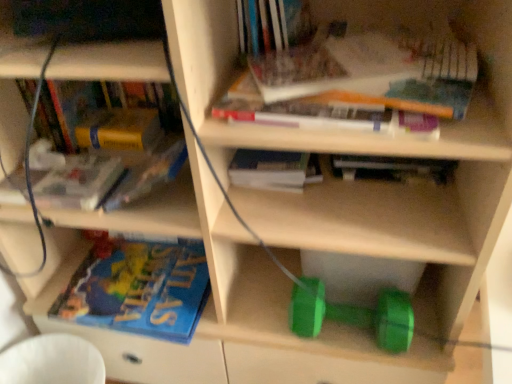
In order to click on yellow matte book at upper left, which is the third book in bottom-to-top order in this screenshot , I will do `click(148, 173)`.

Identify the location of white plastic swivel chair at lower left. (52, 361).

Measure the distance between point (118, 141) and camera.

A distance of 36.69 inches exists between point (118, 141) and camera.

Describe the element at coordinates (120, 130) in the screenshot. I see `yellow matte paperback book at upper left` at that location.

Describe the element at coordinates (274, 170) in the screenshot. The width and height of the screenshot is (512, 384). I see `hardcover book at center, which ranks as the third book in top-to-bottom order` at that location.

Describe the element at coordinates (353, 314) in the screenshot. I see `green rubber dumbbell at lower center` at that location.

Where is `green rubber dumbbell at lower center`? green rubber dumbbell at lower center is located at coordinates (353, 314).

What is the approximate height of hardcover book at upper center, the fourth book viewed from the top?

The height of hardcover book at upper center, the fourth book viewed from the top, is 2.62 inches.

You are a GUI agent. You are given a task and a screenshot of the screen. Output one action in this format:
    pyautogui.click(x=<x>, y=<y>)
    Task: Click on the hardcover book at upper center, the 2th book viewed from the top
    The height and width of the screenshot is (384, 512).
    Given the screenshot: What is the action you would take?
    pyautogui.click(x=357, y=80)

Which of these two, hardcover book at upper center, the 4th book positioned from the bottom, or green rubber dumbbell at lower center, stands taller?

green rubber dumbbell at lower center.

From the image's perspective, which object appears higher, hardcover book at upper center, the fourth book viewed from the top, or green rubber dumbbell at lower center?

hardcover book at upper center, the fourth book viewed from the top, from the image's perspective.

Which object is wider, hardcover book at upper center, the 4th book positioned from the bottom, or green rubber dumbbell at lower center?

green rubber dumbbell at lower center is wider.

Measure the distance from hardcover book at upper center, the 4th book positioned from the bottom, to green rubber dumbbell at lower center.

A distance of 25.49 centimeters exists between hardcover book at upper center, the 4th book positioned from the bottom, and green rubber dumbbell at lower center.

Which point is more distant from viewer, (104, 201) or (426, 167)?

Point (426, 167)

How far apart are yellow matte book at upper left, which is the third book in bottom-to-top order, and hardcover book at upper center, the 4th book positioned from the bottom?

yellow matte book at upper left, which is the third book in bottom-to-top order, and hardcover book at upper center, the 4th book positioned from the bottom, are 38.49 centimeters apart.

Consider the image. From the image's perspective, which object appears higher, yellow matte book at upper left, acting as the fifth book starting from the top, or hardcover book at upper center, the 4th book positioned from the bottom?

hardcover book at upper center, the 4th book positioned from the bottom, from the image's perspective.

From the image's perspective, is green rubber dumbbell at lower center beneath hardcover book at center, which is counted as the 5th book, starting from the bottom?

Yes, from the image's perspective, green rubber dumbbell at lower center is below hardcover book at center, which is counted as the 5th book, starting from the bottom.

How distant is green rubber dumbbell at lower center from hardcover book at center, which ranks as the third book in top-to-bottom order?

They are 9.96 inches apart.

Are green rubber dumbbell at lower center and hardcover book at center, which ranks as the third book in top-to-bottom order, far apart?

No, there isn't a large distance between green rubber dumbbell at lower center and hardcover book at center, which ranks as the third book in top-to-bottom order.

Is green rubber dumbbell at lower center oriented away from hardcover book at center, which is counted as the 5th book, starting from the bottom?

No, hardcover book at center, which is counted as the 5th book, starting from the bottom, is not at the back of green rubber dumbbell at lower center.

From the image's perspective, who appears lower, yellow matte paperback book at upper left or hardcover book at upper center, the fourth book viewed from the top?

hardcover book at upper center, the fourth book viewed from the top, appears lower in the image.

Measure the distance from yellow matte paperback book at upper left to hardcover book at upper center, the 4th book positioned from the bottom.

The distance of yellow matte paperback book at upper left from hardcover book at upper center, the 4th book positioned from the bottom, is 19.69 inches.

Considering the sizes of objects yellow matte paperback book at upper left and hardcover book at upper center, the fourth book viewed from the top, in the image provided, who is thinner, yellow matte paperback book at upper left or hardcover book at upper center, the fourth book viewed from the top,?

hardcover book at upper center, the fourth book viewed from the top.

Is point (458, 116) positioned in front of point (147, 190)?

Yes, it is.

From the image's perspective, which object appears higher, hardcover book at upper center, which appears as the sixth book when ordered from the bottom, or yellow matte book at upper left, acting as the fifth book starting from the top?

hardcover book at upper center, which appears as the sixth book when ordered from the bottom, is shown above in the image.

Between hardcover book at upper center, which appears as the sixth book when ordered from the bottom, and yellow matte book at upper left, which is the third book in bottom-to-top order, which one has smaller size?

yellow matte book at upper left, which is the third book in bottom-to-top order.

The width and height of the screenshot is (512, 384). Find the location of `the 3rd book below the hardcover book at upper center, the 2th book viewed from the top (from the image's perspective)`. the 3rd book below the hardcover book at upper center, the 2th book viewed from the top (from the image's perspective) is located at coordinates (148, 173).

From a real-world perspective, is white plastic swivel chair at lower left physically below hardcover book at upper center, the 2th book viewed from the top?

Indeed, from a real-world perspective, white plastic swivel chair at lower left is positioned beneath hardcover book at upper center, the 2th book viewed from the top.

Image resolution: width=512 pixels, height=384 pixels. I want to click on swivel chair that appears below the hardcover book at upper center, which appears as the sixth book when ordered from the bottom (from the image's perspective), so click(52, 361).

Considering the sizes of objects white plastic swivel chair at lower left and hardcover book at upper center, the 2th book viewed from the top, in the image provided, who is shorter, white plastic swivel chair at lower left or hardcover book at upper center, the 2th book viewed from the top,?

Standing shorter between the two is hardcover book at upper center, the 2th book viewed from the top.

Consider the image. Which of these two, white plastic swivel chair at lower left or hardcover book at upper center, the 2th book viewed from the top, is thinner?

Thinner between the two is white plastic swivel chair at lower left.

Could you tell me if hardcover book at center, which ranks as the third book in top-to-bottom order, is facing hardcover book at upper center, placed as the 1th book when sorted from top to bottom?

No, hardcover book at center, which ranks as the third book in top-to-bottom order, is not turned towards hardcover book at upper center, placed as the 1th book when sorted from top to bottom.

Is point (297, 185) more distant than point (304, 18)?

No, (297, 185) is in front of (304, 18).

Could hardcover book at upper center, placed as the 1th book when sorted from top to bottom, be considered to be inside hardcover book at center, which is counted as the 5th book, starting from the bottom?

Actually, hardcover book at upper center, placed as the 1th book when sorted from top to bottom, is outside hardcover book at center, which is counted as the 5th book, starting from the bottom.

I want to click on dumbbell that appears in front of the hardcover book at upper center, the fourth book viewed from the top, so click(353, 314).

The height and width of the screenshot is (384, 512). I want to click on the 4th book to the right of the yellow matte book at upper left, acting as the fifth book starting from the top, starting your count from the anchor, so click(x=393, y=169).

Considering their positions, is yellow matte paperback book at upper left positioned closer to hardcover book at center, which is counted as the 5th book, starting from the bottom, than translucent plastic book at upper left, marked as the second book in a bottom-to-top arrangement?

yellow matte paperback book at upper left lies closer to hardcover book at center, which is counted as the 5th book, starting from the bottom, than the other object.

From the image, which object appears to be nearer to hardcover book at upper center, placed as the 1th book when sorted from top to bottom, yellow matte paperback book at upper left or green rubber dumbbell at lower center?

The object closer to hardcover book at upper center, placed as the 1th book when sorted from top to bottom, is yellow matte paperback book at upper left.

Considering their positions, is yellow matte book at upper left, which is the third book in bottom-to-top order, positioned closer to white plastic swivel chair at lower left than hardcover book at upper center, placed as the 7th book when sorted from bottom to top?

yellow matte book at upper left, which is the third book in bottom-to-top order, lies closer to white plastic swivel chair at lower left than the other object.

When comparing their distances from hardcover book at upper center, the 4th book positioned from the bottom, does white plastic swivel chair at lower left or hardcover book at upper center, placed as the 7th book when sorted from bottom to top, seem further?

white plastic swivel chair at lower left is positioned further to the anchor hardcover book at upper center, the 4th book positioned from the bottom.

When comparing their distances from green rubber dumbbell at lower center, does yellow matte paperback book at upper left or white plastic swivel chair at lower left seem further?

The object further to green rubber dumbbell at lower center is white plastic swivel chair at lower left.

Which object lies further to the anchor point blue matte book at lower left, placed as the first book when sorted from bottom to top, white plastic swivel chair at lower left or hardcover book at upper center, the 4th book positioned from the bottom?

hardcover book at upper center, the 4th book positioned from the bottom, lies further to blue matte book at lower left, placed as the first book when sorted from bottom to top, than the other object.

Considering their positions, is white plastic swivel chair at lower left positioned further to translucent plastic book at upper left, marked as the second book in a bottom-to-top arrangement, than hardcover book at upper center, placed as the 1th book when sorted from top to bottom?

hardcover book at upper center, placed as the 1th book when sorted from top to bottom, lies further to translucent plastic book at upper left, marked as the second book in a bottom-to-top arrangement, than the other object.

From the picture: Looking at the image, which one is located further to yellow matte book at upper left, which is the third book in bottom-to-top order, hardcover book at upper center, placed as the 1th book when sorted from top to bottom, or yellow matte paperback book at upper left?

hardcover book at upper center, placed as the 1th book when sorted from top to bottom.

Find the location of a particular element. The image size is (512, 384). paperback book between translucent plastic book at upper left, which appears as the sixth book when viewed from the top, and hardcover book at upper center, the fourth book viewed from the top, from left to right is located at coordinates (120, 130).

You are a GUI agent. You are given a task and a screenshot of the screen. Output one action in this format:
    pyautogui.click(x=<x>, y=<y>)
    Task: Click on the paperback book between hardcover book at upper center, placed as the 1th book when sorted from top to bottom, and white plastic swivel chair at lower left in the up-down direction
    This screenshot has height=384, width=512.
    Given the screenshot: What is the action you would take?
    pyautogui.click(x=120, y=130)

Identify the location of dumbbell located between yellow matte book at upper left, which is the third book in bottom-to-top order, and hardcover book at upper center, the 4th book positioned from the bottom, in the left-right direction. The height and width of the screenshot is (384, 512). (353, 314).

This screenshot has height=384, width=512. Find the location of `dumbbell between blue matte book at lower left, the 7th book viewed from the top, and hardcover book at upper center, the 4th book positioned from the bottom`. dumbbell between blue matte book at lower left, the 7th book viewed from the top, and hardcover book at upper center, the 4th book positioned from the bottom is located at coordinates (353, 314).